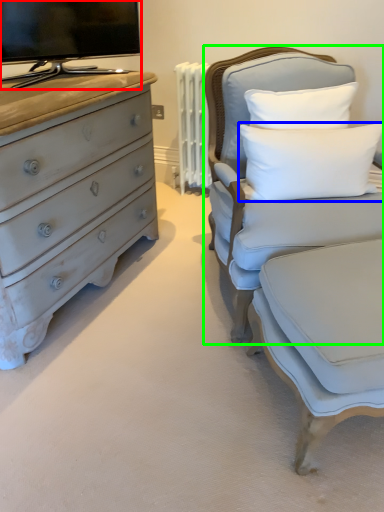
Question: Which object is the farthest from television (highlighted by a red box)? Choose among these: pillow (highlighted by a blue box) or chair (highlighted by a green box).

Choices:
 (A) pillow
 (B) chair

Answer: (A)